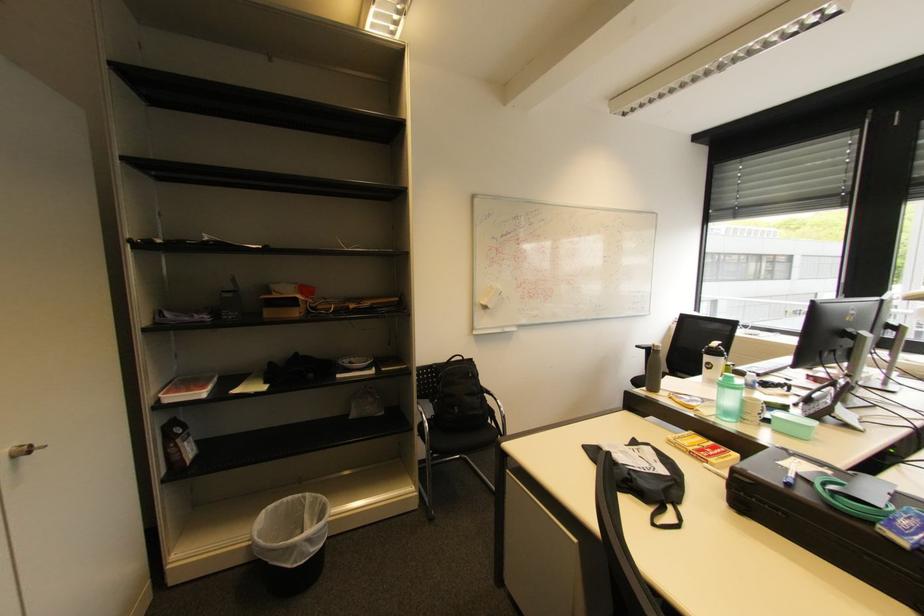
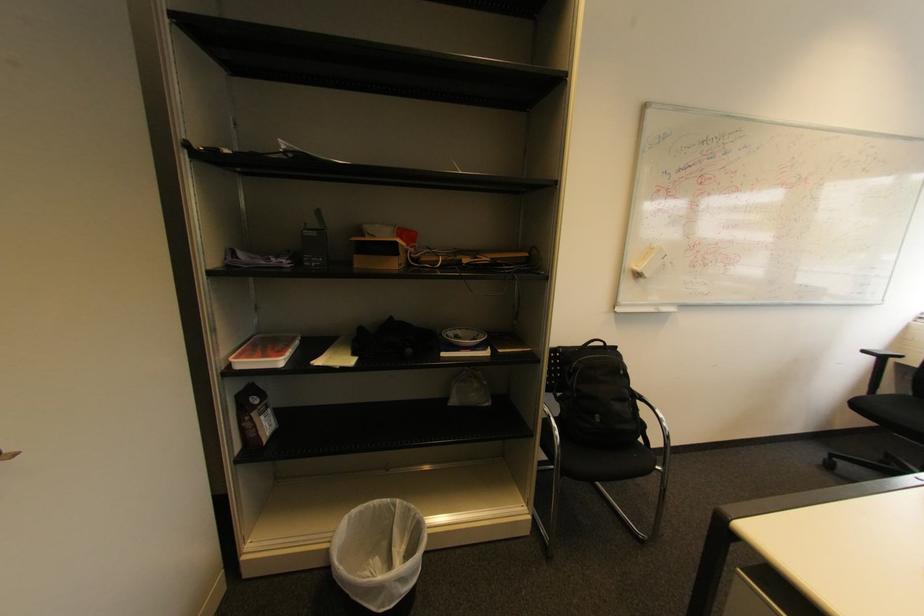
In the second image, find the point that corresponds to point 298,304 in the first image.

(395, 251)